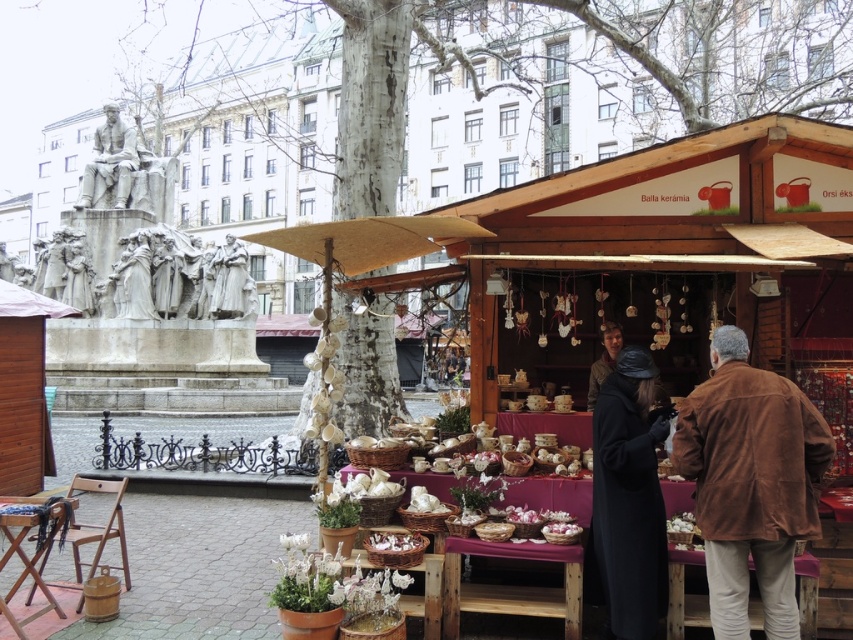
Question: Which point is closer to the camera?

Choices:
 (A) dark brown leather jacket at lower right
 (B) black wool coat at center
 (C) brown suede jacket at lower right

Answer: (C)

Question: Considering the real-world distances, which object is farthest from the dark brown leather jacket at lower right?

Choices:
 (A) black wool coat at center
 (B) brown suede jacket at lower right

Answer: (B)

Question: Considering the real-world distances, which object is closest to the black wool coat at center?

Choices:
 (A) brown suede jacket at lower right
 (B) dark brown leather jacket at lower right

Answer: (A)

Question: Observing the image, what is the correct spatial positioning of brown suede jacket at lower right in reference to black wool coat at center?

Choices:
 (A) left
 (B) right

Answer: (B)

Question: Does brown suede jacket at lower right appear on the right side of dark brown leather jacket at lower right?

Choices:
 (A) yes
 (B) no

Answer: (A)

Question: Is brown suede jacket at lower right to the left of black wool coat at center from the viewer's perspective?

Choices:
 (A) yes
 (B) no

Answer: (B)